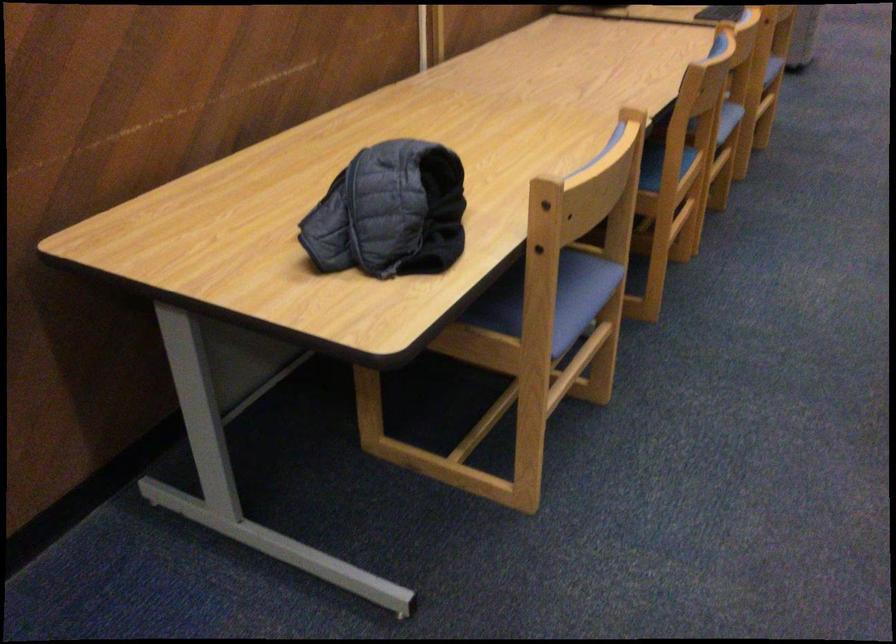
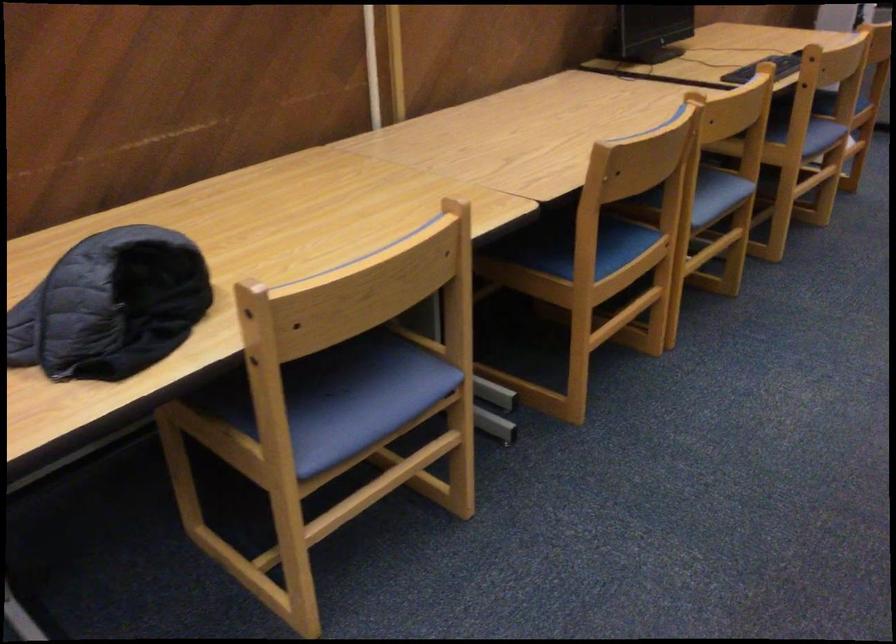
Find the pixel in the second image that matches point (650, 166) in the first image.

(597, 248)